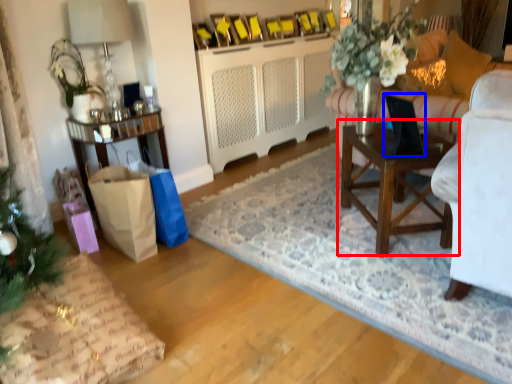
Question: Which point is further to the camera, table (highlighted by a red box) or laptop (highlighted by a blue box)?

Choices:
 (A) table
 (B) laptop

Answer: (A)